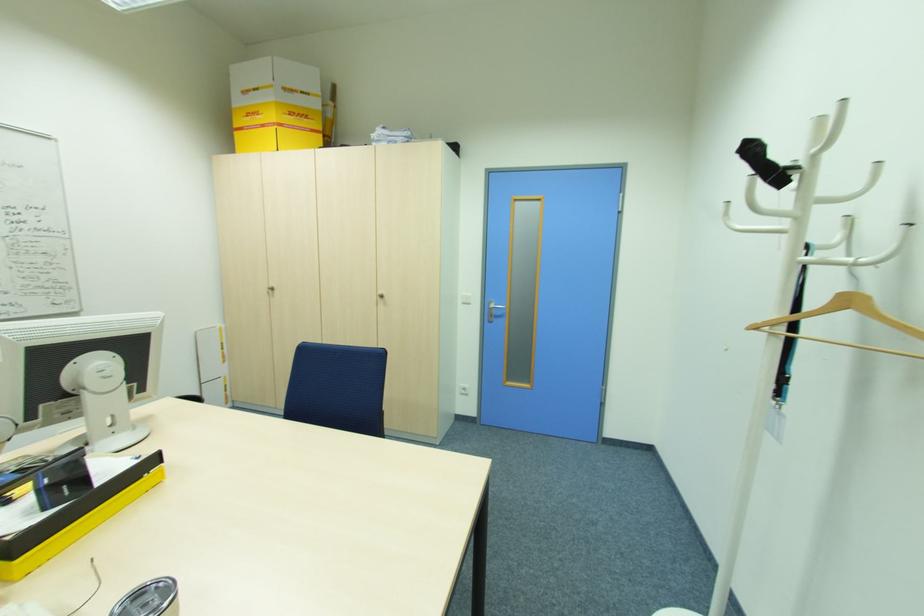
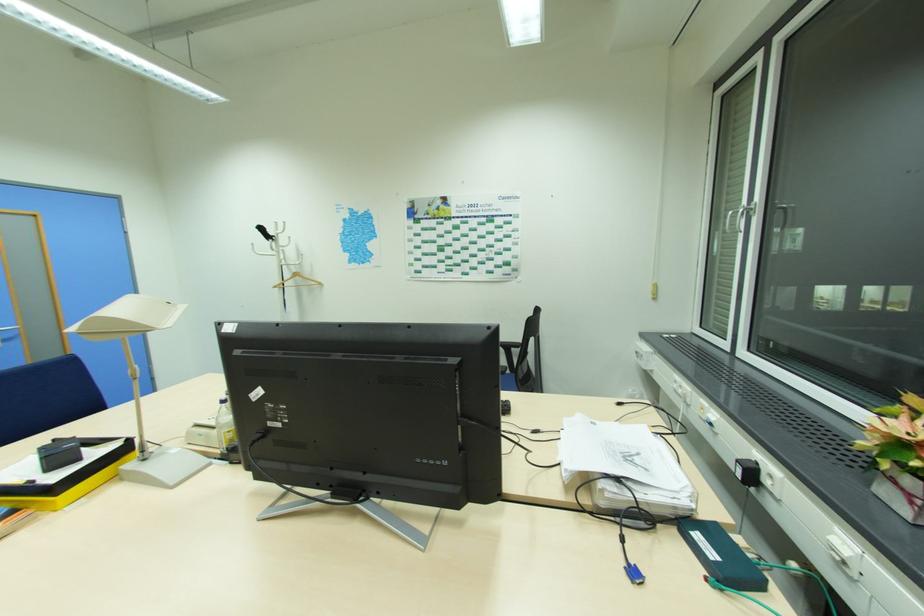
Where in the second image is the point corresponding to (759,326) from the first image?

(277, 286)